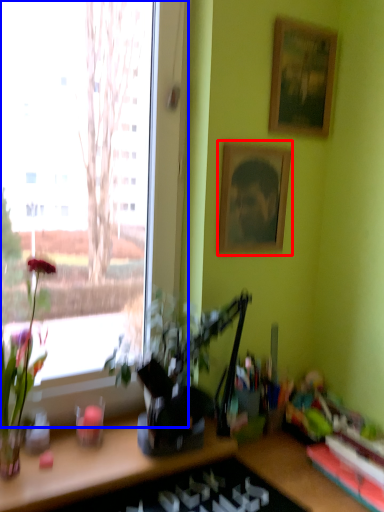
Question: Among these objects, which one is nearest to the camera, picture frame (highlighted by a red box) or window (highlighted by a blue box)?

Choices:
 (A) picture frame
 (B) window

Answer: (B)